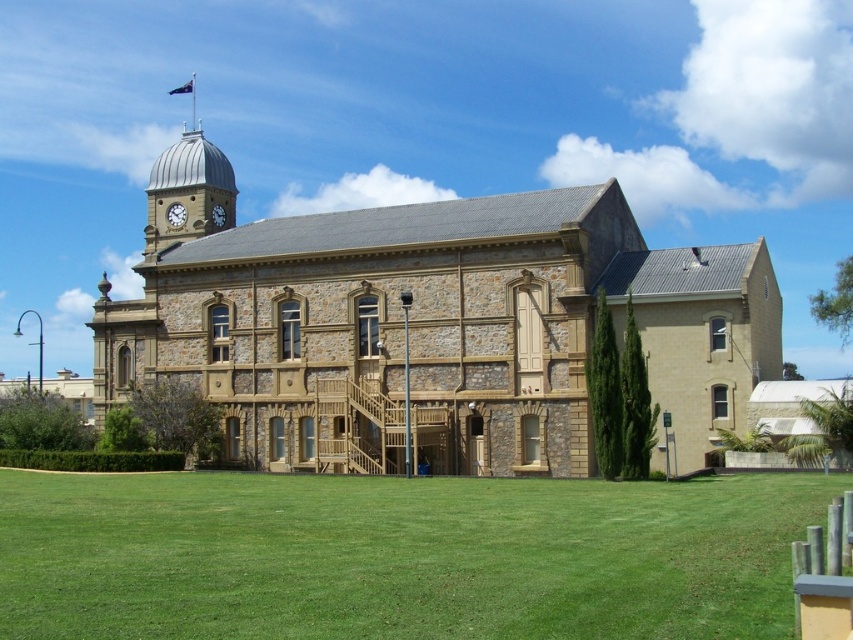
You are standing in front of the historic building and want to know which object occupies more horizontal space in the image. Which one is wider between the green grass at lower center and the matte silver clock at upper left?

The green grass at lower center is wider than the matte silver clock at upper left according to the description.

You are standing at the base of the wooden staircase leading to the main entrance of the historic building. You notice the green grass at lower center and the matte silver clock at upper left. Which object is closer to your current position?

The green grass at lower center is closer to your current position because it is in front of the matte silver clock at upper left.